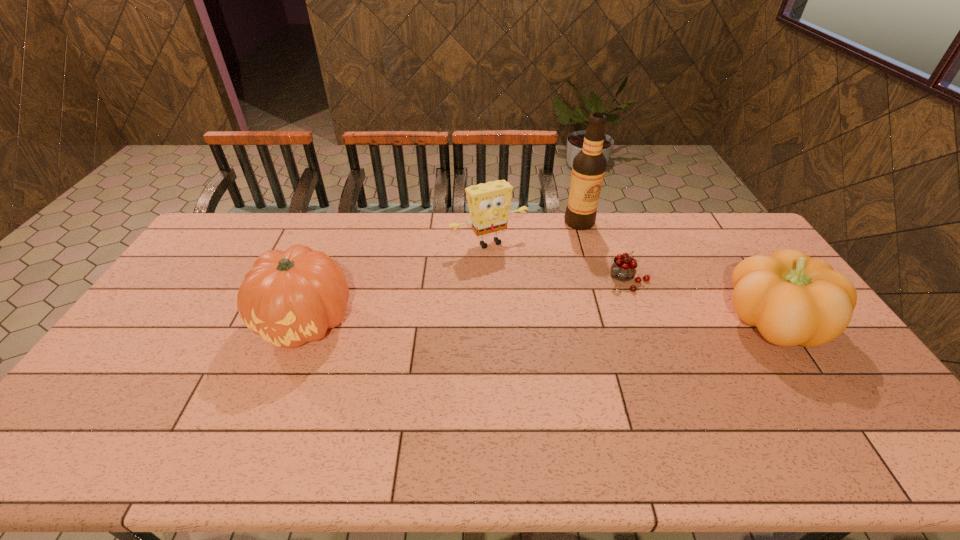
Where is `blank region between the right pumpkin and the left pumpkin`? The width and height of the screenshot is (960, 540). blank region between the right pumpkin and the left pumpkin is located at coordinates (540, 322).

The width and height of the screenshot is (960, 540). What are the coordinates of `vacant space that is in between the pot filled with cherries and the right pumpkin` in the screenshot? It's located at (700, 301).

In order to click on vacant point located between the left pumpkin and the pot filled with cherries in this screenshot , I will do `click(467, 301)`.

Locate an element on the screen. The height and width of the screenshot is (540, 960). vacant region between the rightmost object and the shortest object is located at coordinates (700, 301).

Where is `free space between the right pumpkin and the left pumpkin`? The height and width of the screenshot is (540, 960). free space between the right pumpkin and the left pumpkin is located at coordinates (540, 322).

Select which object is the closest to the right pumpkin. Please provide its 2D coordinates. Your answer should be formatted as a tuple, i.e. [(x, y)], where the tuple contains the x and y coordinates of a point satisfying the conditions above.

[(624, 267)]

Where is `the third closest object relative to the shortest object`? the third closest object relative to the shortest object is located at coordinates pyautogui.click(x=489, y=204).